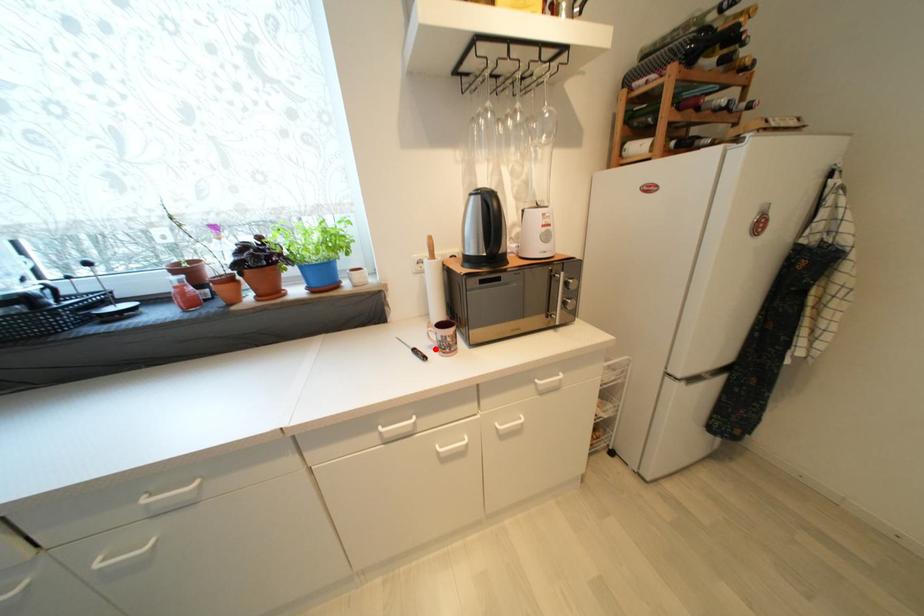
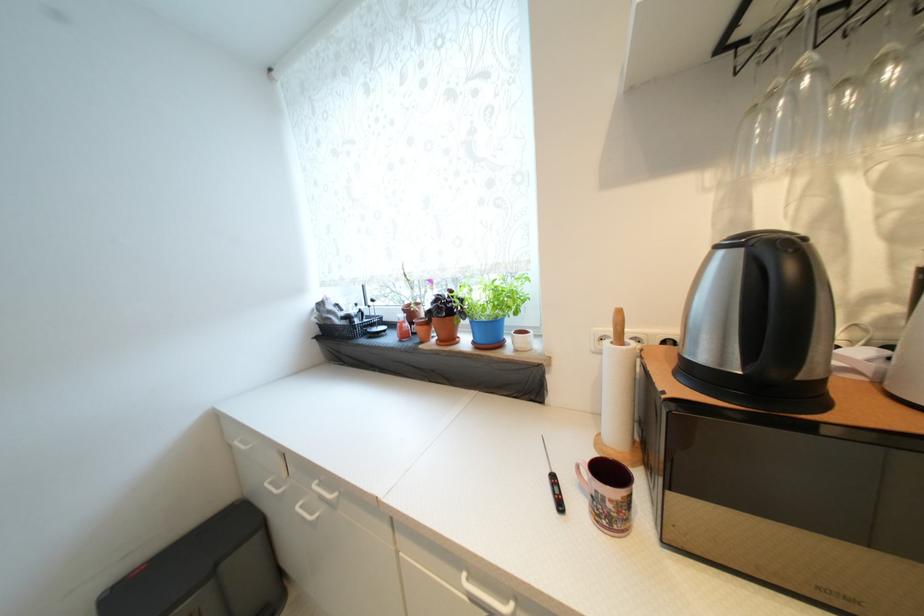
Where in the second image is the point corresponding to the highlighted location from the first image?

(586, 488)